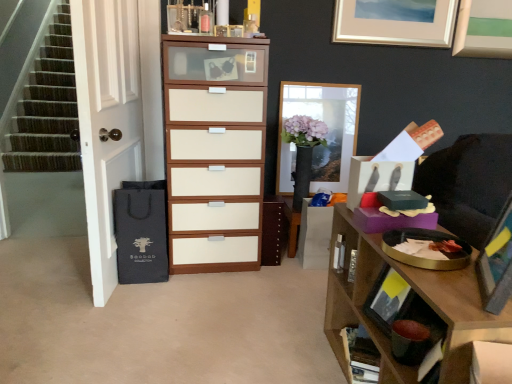
Question: From a real-world perspective, is matte black drawer at upper right positioned above or below matte silver picture frame at upper center, the second picture frame in the front-to-back sequence?

Choices:
 (A) below
 (B) above

Answer: (A)

Question: In terms of width, does matte black drawer at upper right look wider or thinner when compared to matte silver picture frame at upper center, the second picture frame in the front-to-back sequence?

Choices:
 (A) wide
 (B) thin

Answer: (A)

Question: Estimate the real-world distances between objects in this image. Which object is closer to the matte white wood chest of drawers at center?

Choices:
 (A) wooden tray at upper right
 (B) matte silver picture frame at upper center, which is counted as the second picture frame, starting from the back
 (C) matte white picture frame at center, marked as the first picture frame in a back-to-front arrangement
 (D) wooden picture frame at right, placed as the third picture frame when sorted from back to front
 (E) matte black drawer at upper right

Answer: (C)

Question: Which of these objects is positioned farthest from the wooden tray at upper right?

Choices:
 (A) matte white wood chest of drawers at center
 (B) brown wood cabinet at center
 (C) matte black drawer at upper right
 (D) wooden bookshelf at lower right
 (E) matte white picture frame at center, the third picture frame viewed from the front

Answer: (E)